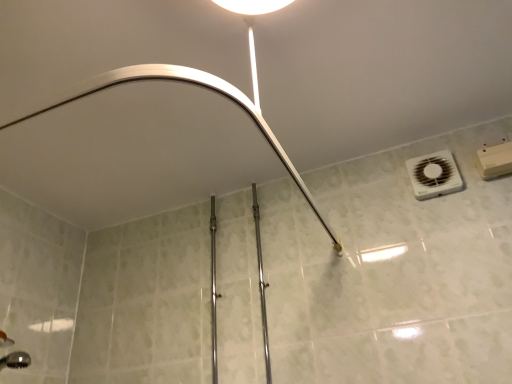
Question: Is matte white shower arm at upper center inside or outside of polished chrome rail at center?

Choices:
 (A) outside
 (B) inside

Answer: (A)

Question: In the image, is matte white shower arm at upper center on the left side or the right side of polished chrome rail at center?

Choices:
 (A) right
 (B) left

Answer: (B)

Question: Which object is positioned farthest from the matte white shower arm at upper center?

Choices:
 (A) white plastic air conditioning at upper right
 (B) polished chrome rail at center

Answer: (B)

Question: Based on their relative distances, which object is farther from the polished chrome rail at center?

Choices:
 (A) matte white shower arm at upper center
 (B) white plastic air conditioning at upper right

Answer: (A)